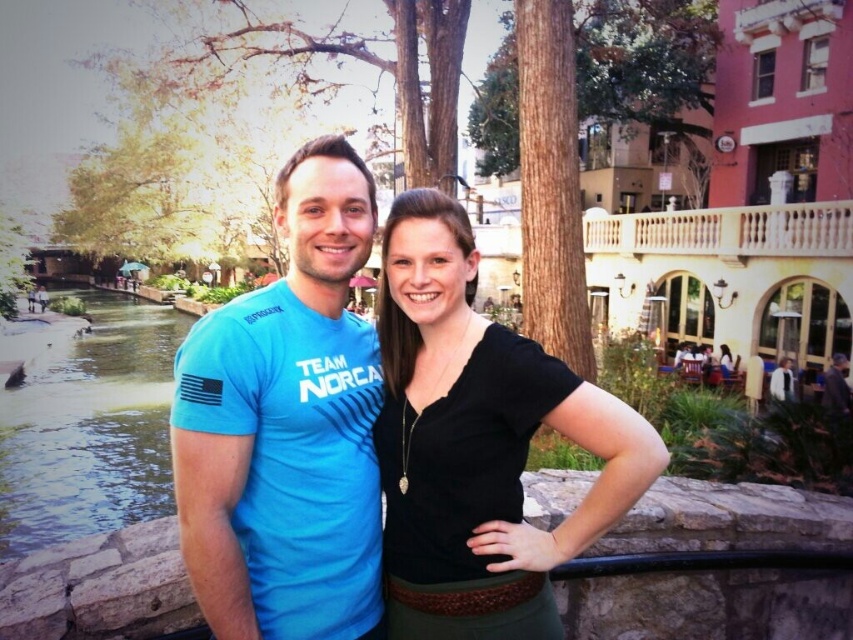
Question: Does blue fabric shirt at center appear over black matte shirt at center?

Choices:
 (A) no
 (B) yes

Answer: (B)

Question: Which is nearer to the dark gray fabric jacket at center?

Choices:
 (A) black matte shirt at center
 (B) blue fabric shirt at center

Answer: (A)

Question: Which point is closer to the camera?

Choices:
 (A) blue fabric shirt at center
 (B) dark gray fabric jacket at center
 (C) black matte shirt at center

Answer: (A)

Question: Observing the image, what is the correct spatial positioning of black matte shirt at center in reference to dark gray fabric jacket at center?

Choices:
 (A) left
 (B) right

Answer: (A)

Question: Which of these objects is positioned closest to the blue fabric shirt at center?

Choices:
 (A) dark gray fabric jacket at center
 (B) black matte shirt at center

Answer: (B)

Question: From the image, what is the correct spatial relationship of blue fabric shirt at center in relation to dark gray fabric jacket at center?

Choices:
 (A) right
 (B) left

Answer: (B)